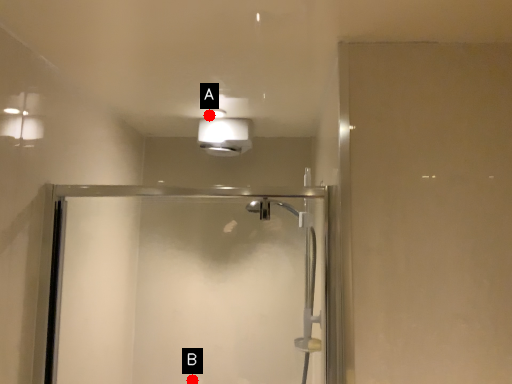
Question: Two points are circled on the image, labeled by A and B beside each circle. Which point is closer to the camera?

Choices:
 (A) A is closer
 (B) B is closer

Answer: (A)